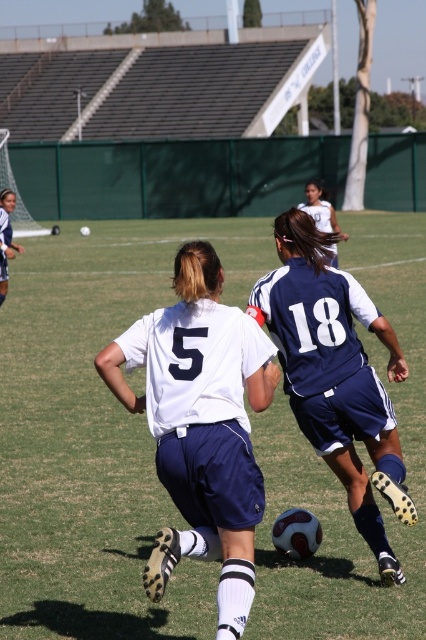
Which is in front, point (261, 282) or point (330, 208)?

Positioned in front is point (261, 282).

Can you confirm if blue fabric soccer jersey at center is bigger than white jersey at center?

Actually, blue fabric soccer jersey at center might be smaller than white jersey at center.

Is point (385, 420) farther from camera compared to point (316, 227)?

No, (385, 420) is closer to viewer.

The image size is (426, 640). In order to click on blue fabric soccer jersey at center in this screenshot , I will do `click(336, 374)`.

Is point (221, 460) closer to viewer compared to point (389, 493)?

That is True.

Which of these two, white matte jersey at center or blue fabric soccer jersey at center, stands taller?

blue fabric soccer jersey at center

Is point (146, 404) closer to camera compared to point (382, 477)?

Yes, it is in front of point (382, 477).

Where is `white matte jersey at center`? white matte jersey at center is located at coordinates (201, 424).

Can you confirm if white matte jersey at center is positioned to the left of white jersey at center?

Indeed, white matte jersey at center is positioned on the left side of white jersey at center.

Does point (173, 310) come closer to viewer compared to point (325, 202)?

That is True.

I want to click on white matte jersey at center, so click(x=201, y=424).